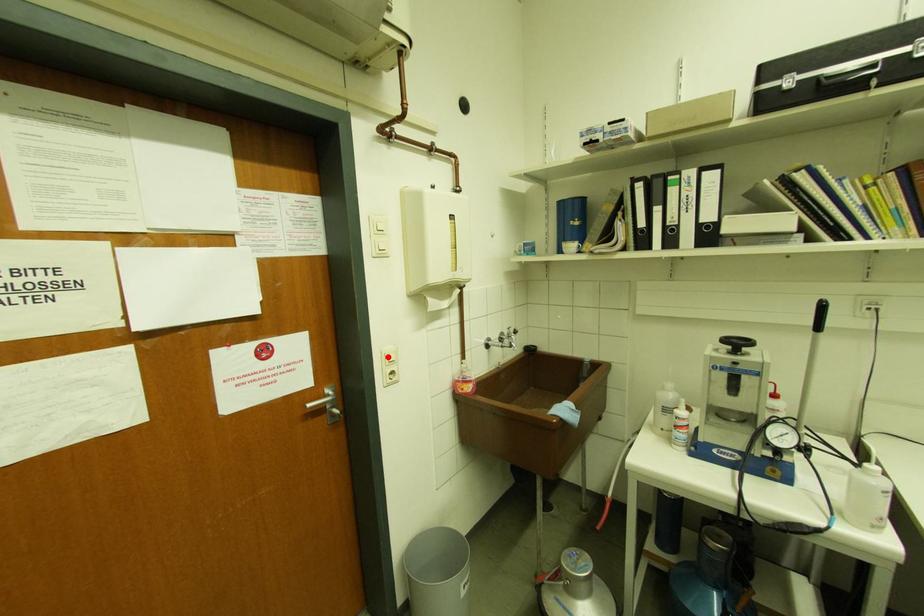
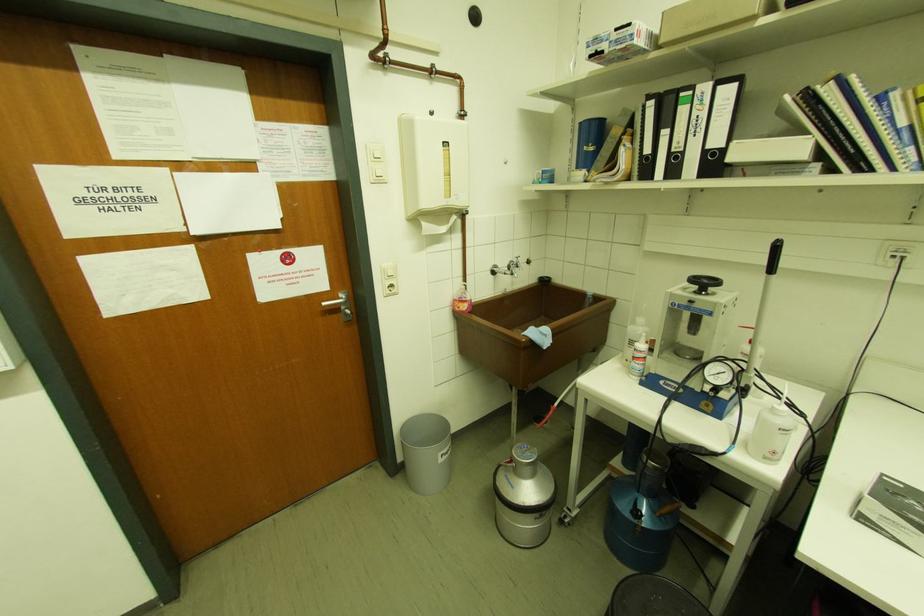
In the second image, find the point that corresponds to the highlighted location in the first image.

(386, 272)